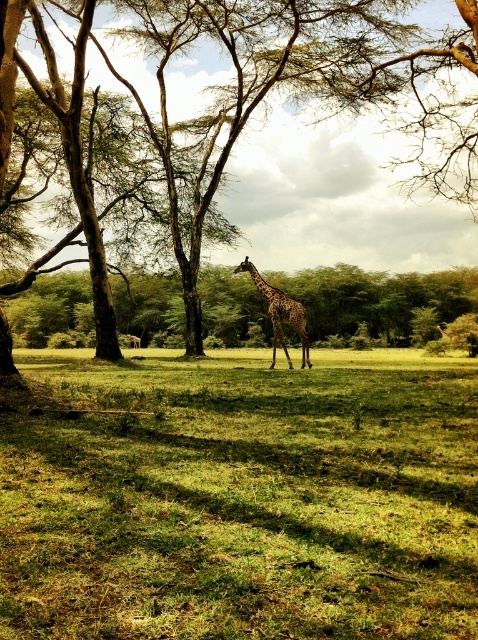
Is green grassy field at center thinner than spotted fur giraffe at center?

In fact, green grassy field at center might be wider than spotted fur giraffe at center.

The height and width of the screenshot is (640, 478). What do you see at coordinates (241, 499) in the screenshot?
I see `green grassy field at center` at bounding box center [241, 499].

Which is behind, point (37, 362) or point (304, 328)?

Positioned behind is point (37, 362).

Where is `green grassy field at center`? This screenshot has height=640, width=478. green grassy field at center is located at coordinates (241, 499).

From the picture: Which of these two, brown textured tree at upper left or spotted fur giraffe at center, stands taller?

With more height is brown textured tree at upper left.

Is point (249, 6) positioned behind point (262, 284)?

Yes, it is.

At what (x,y) coordinates should I click in order to perform the action: click on brown textured tree at upper left. Please return your answer as a coordinate pair (x, y). The height and width of the screenshot is (640, 478). Looking at the image, I should click on (10, 54).

Locate an element on the screen. Image resolution: width=478 pixels, height=640 pixels. green grassy field at center is located at coordinates (241, 499).

Is green grassy field at center to the left of brown textured tree at upper left from the viewer's perspective?

Yes, green grassy field at center is to the left of brown textured tree at upper left.

What are the coordinates of `green grassy field at center` in the screenshot? It's located at (241, 499).

Locate an element on the screen. This screenshot has height=640, width=478. green grassy field at center is located at coordinates (241, 499).